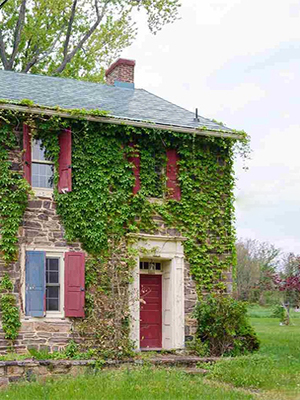
This screenshot has height=400, width=300. I want to click on door, so click(149, 308).